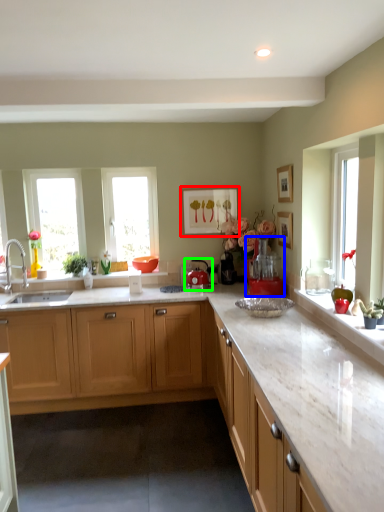
Question: Which object is positioned farthest from picture frame (highlighted by a red box)? Select from coffee machine (highlighted by a blue box) and appliance (highlighted by a green box).

Choices:
 (A) coffee machine
 (B) appliance

Answer: (A)